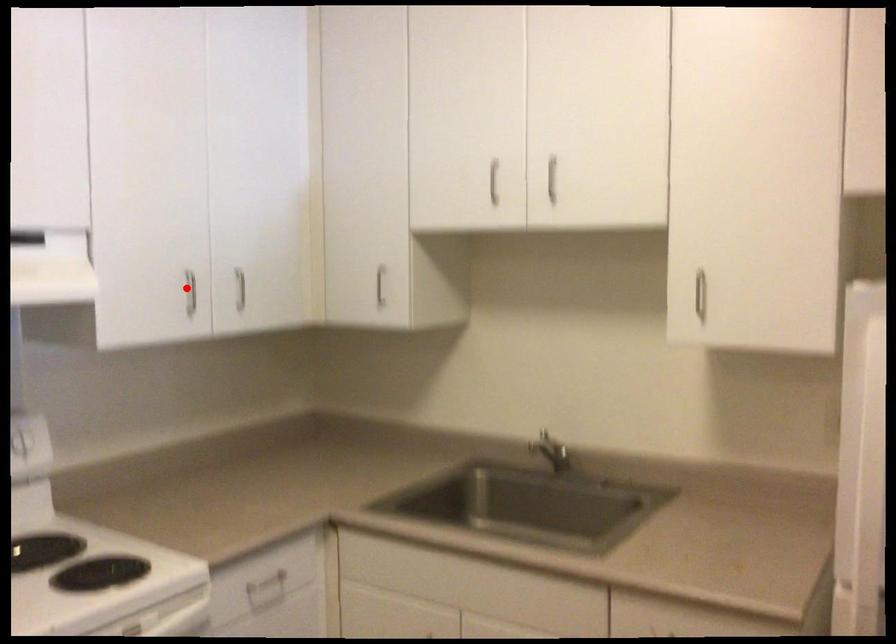
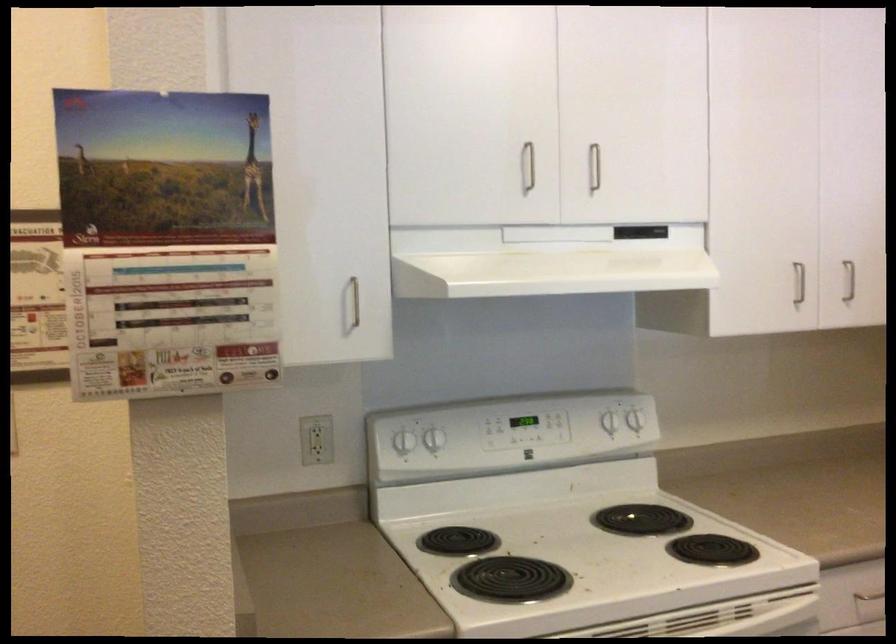
In the second image, find the point that corresponds to the highlighted location in the first image.

(798, 283)